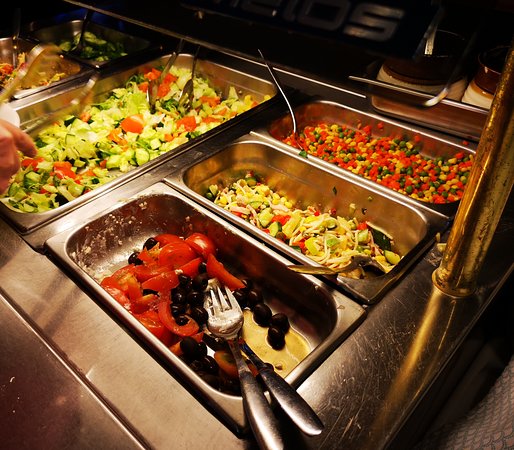
Where is `metsl dish`? metsl dish is located at coordinates (122, 314).